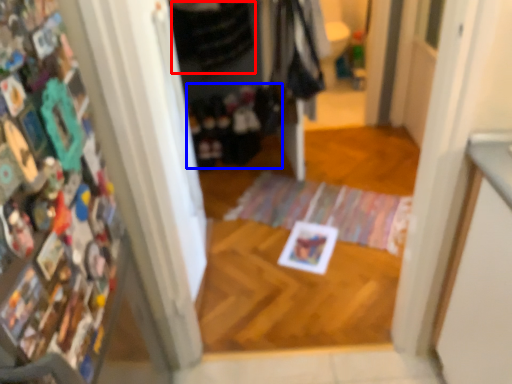
Question: Which point is further to the camera, clothing (highlighted by a red box) or clothing (highlighted by a blue box)?

Choices:
 (A) clothing
 (B) clothing

Answer: (B)